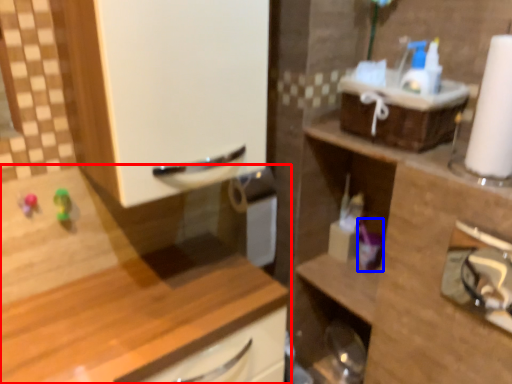
Question: Among these objects, which one is farthest to the camera, cabinetry (highlighted by a red box) or toiletry (highlighted by a blue box)?

Choices:
 (A) cabinetry
 (B) toiletry

Answer: (B)